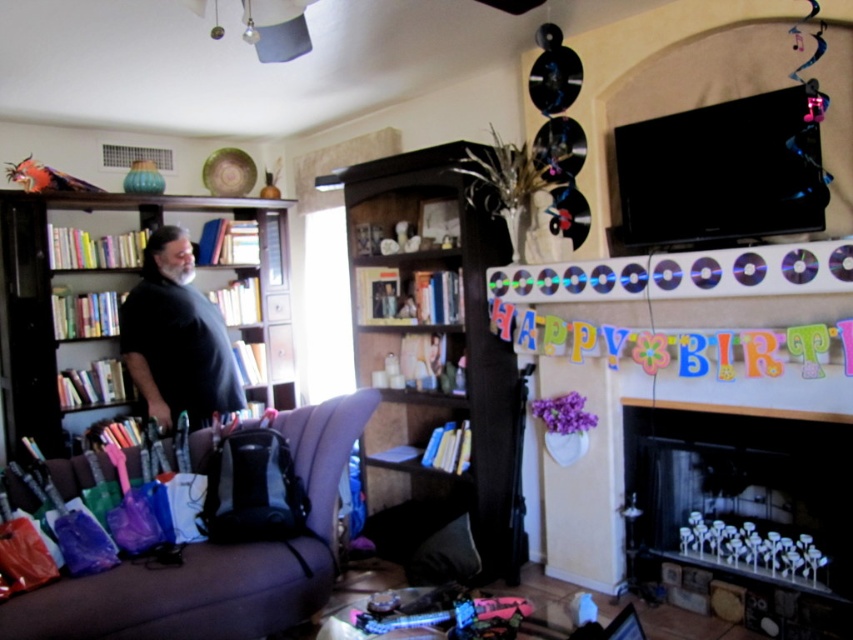
Question: Is dark wood bookshelf at center smaller than black wood bookcase at left?

Choices:
 (A) no
 (B) yes

Answer: (B)

Question: Which of the following is the closest to the observer?

Choices:
 (A) (151, 243)
 (B) (445, 166)

Answer: (B)

Question: Is black glass fireplace at lower right behind black matte shirt at left?

Choices:
 (A) no
 (B) yes

Answer: (A)

Question: Among these points, which one is nearest to the camera?

Choices:
 (A) (718, 417)
 (B) (59, 403)
 (C) (316, 522)
 (D) (410, 253)

Answer: (A)

Question: Can you confirm if brown fabric couch at lower left is positioned below black matte shirt at left?

Choices:
 (A) yes
 (B) no

Answer: (A)

Question: Which point appears closest to the camera in this image?

Choices:
 (A) (846, 458)
 (B) (140, 388)
 (C) (428, 340)

Answer: (A)